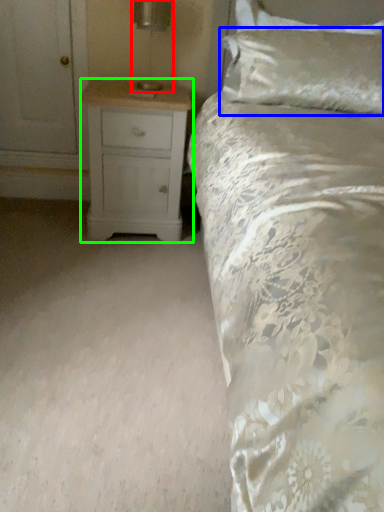
Question: Considering the real-world distances, which object is farthest from table lamp (highlighted by a red box)? pillow (highlighted by a blue box) or chest of drawers (highlighted by a green box)?

Choices:
 (A) pillow
 (B) chest of drawers

Answer: (A)